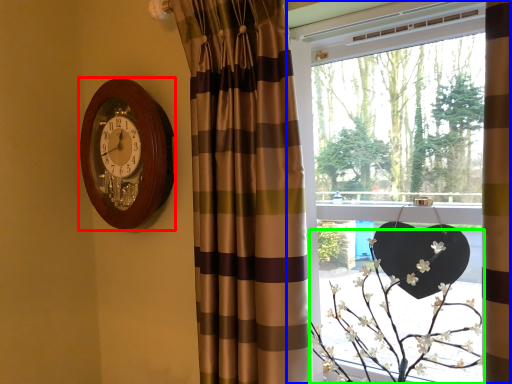
Question: Considering the real-world distances, which object is closest to wall clock (highlighted by a red box)? window (highlighted by a blue box) or floral arrangement (highlighted by a green box).

Choices:
 (A) window
 (B) floral arrangement

Answer: (A)